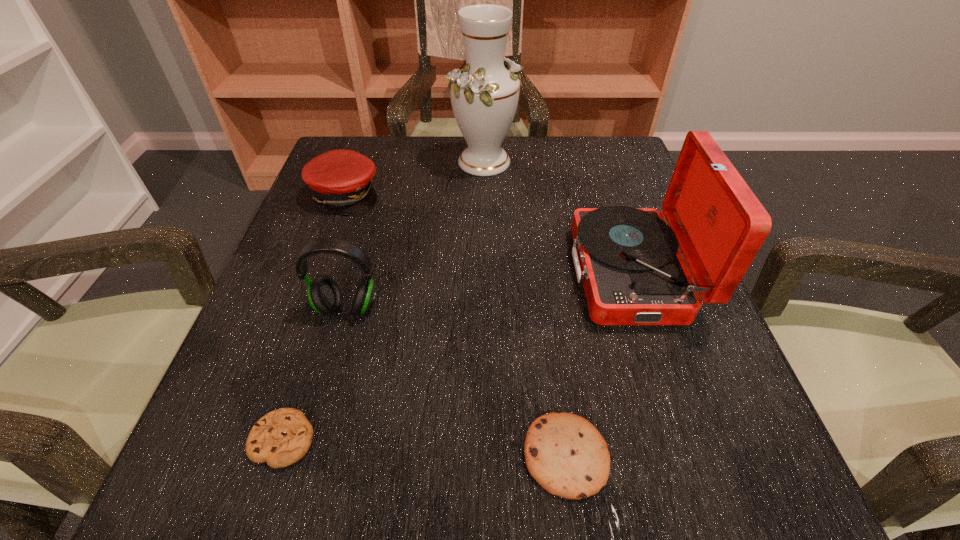
In the image, there is a desktop. Where is `vacant space at the near right corner`? Image resolution: width=960 pixels, height=540 pixels. vacant space at the near right corner is located at coordinates (795, 514).

Locate an element on the screen. This screenshot has height=540, width=960. free space between the fourth tallest object and the left cookie is located at coordinates (314, 317).

The height and width of the screenshot is (540, 960). What are the coordinates of `empty space that is in between the headset and the left cookie` in the screenshot? It's located at (315, 374).

Locate an element on the screen. vacant space in between the taller cookie and the rightmost object is located at coordinates (598, 364).

I want to click on vacant area between the tallest object and the cap, so [415, 178].

Locate an element on the screen. vacant point located between the phonograph_record and the cap is located at coordinates tap(488, 234).

Where is `vacant space that is in between the cap and the tallest object`? vacant space that is in between the cap and the tallest object is located at coordinates (415, 178).

The image size is (960, 540). I want to click on vacant area that lies between the right cookie and the tallest object, so pos(525,309).

This screenshot has width=960, height=540. Find the location of `vacant area that lies between the shorter cookie and the phonograph_record`. vacant area that lies between the shorter cookie and the phonograph_record is located at coordinates (457, 356).

Where is `free spot between the rightmost object and the fifth tallest object`? The height and width of the screenshot is (540, 960). free spot between the rightmost object and the fifth tallest object is located at coordinates (598, 364).